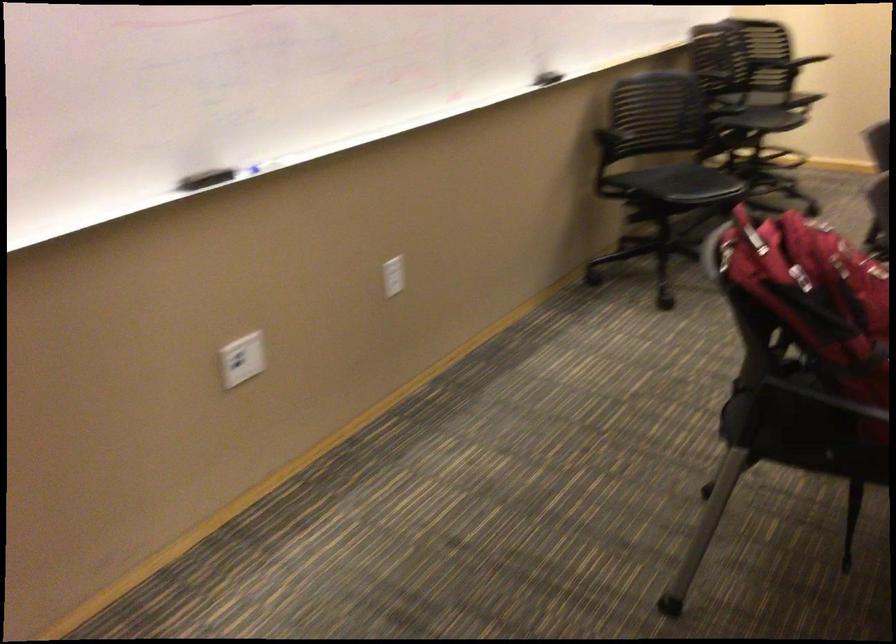
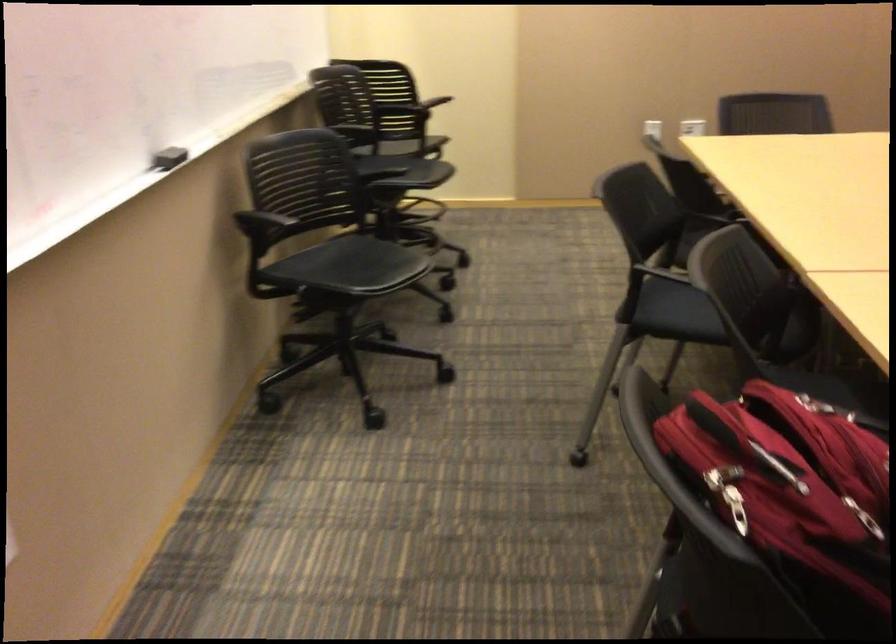
Question: The camera is either moving clockwise (left) or counter-clockwise (right) around the object. The first image is from the beginning of the video and the second image is from the end. Is the camera moving left or right when shooting the video?

Choices:
 (A) Left
 (B) Right

Answer: (A)